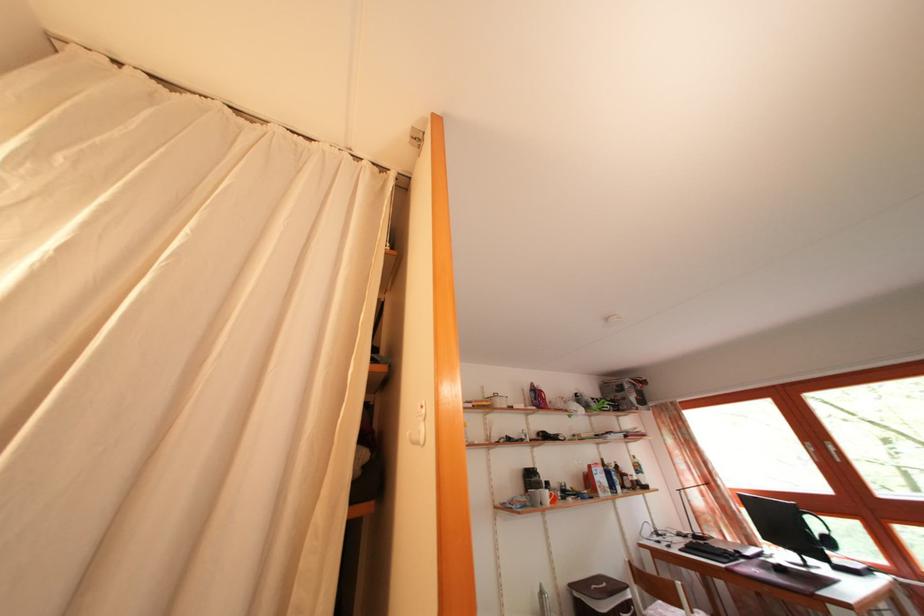
Locate an element on the screen. The height and width of the screenshot is (616, 924). trash bin lid is located at coordinates (598, 586).